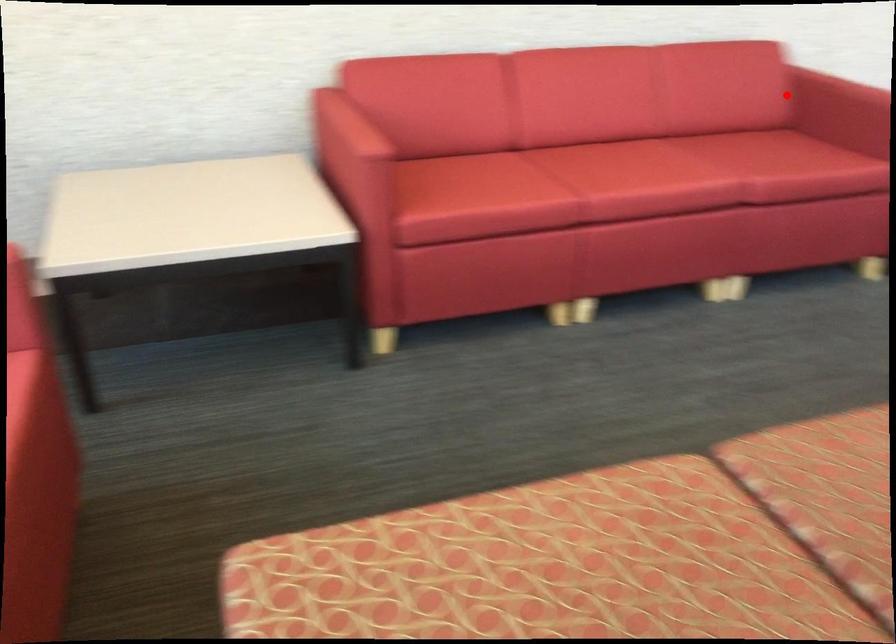
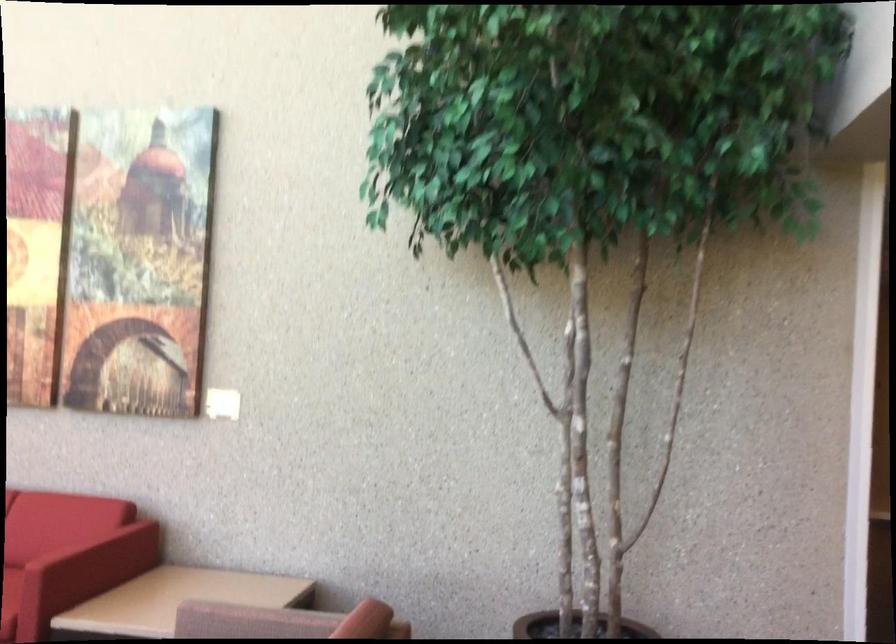
Find the pixel in the second image that matches the highlighted location in the first image.

(80, 540)